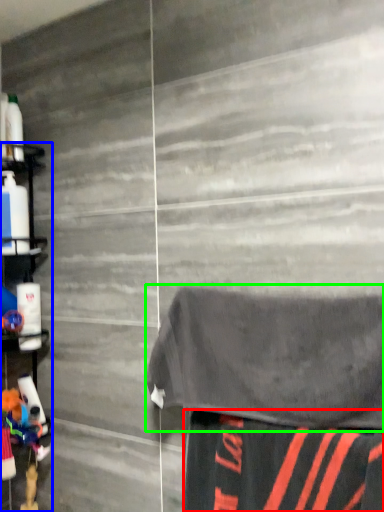
Question: Based on their relative distances, which object is nearer to fabric (highlighted by a red box)? Choose from shelf (highlighted by a blue box) and bath towel (highlighted by a green box).

Choices:
 (A) shelf
 (B) bath towel

Answer: (B)